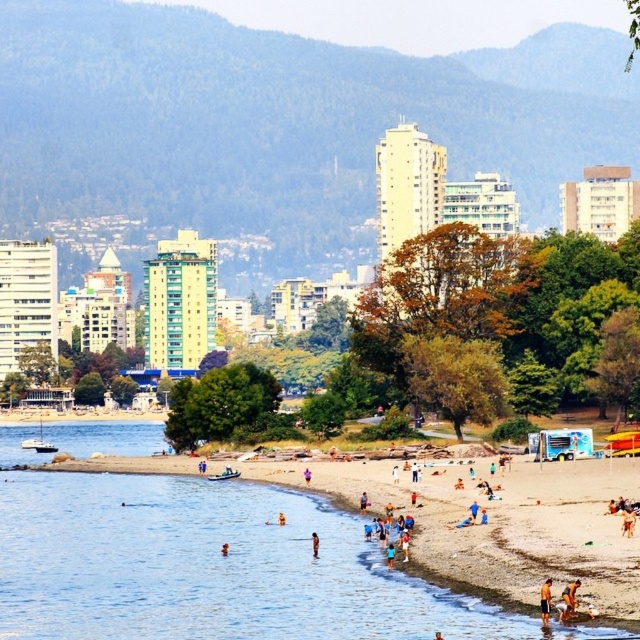
Does smooth sand beach at lower right have a larger size compared to orange fabric shorts at lower right?

Yes, smooth sand beach at lower right is bigger than orange fabric shorts at lower right.

What do you see at coordinates (209, 566) in the screenshot? I see `smooth sand beach at lower right` at bounding box center [209, 566].

At what (x,y) coordinates should I click in order to perform the action: click on smooth sand beach at lower right. Please return your answer as a coordinate pair (x, y). The image size is (640, 640). Looking at the image, I should click on (209, 566).

Does tan skin person at lower right appear over tan skin person at beach center?

Actually, tan skin person at lower right is below tan skin person at beach center.

This screenshot has height=640, width=640. What do you see at coordinates (545, 600) in the screenshot? I see `tan skin person at lower right` at bounding box center [545, 600].

Find the location of a particular element. Image resolution: width=640 pixels, height=640 pixels. tan skin person at lower right is located at coordinates (545, 600).

Which is more to the right, smooth sand beach at lower right or tan skin person at lower right?

Positioned to the right is tan skin person at lower right.

Between smooth sand beach at lower right and tan skin person at lower right, which one is positioned higher?

tan skin person at lower right is higher up.

Which is behind, point (410, 625) or point (547, 588)?

The point (410, 625) is more distant.

This screenshot has width=640, height=640. I want to click on smooth sand beach at lower right, so click(x=209, y=566).